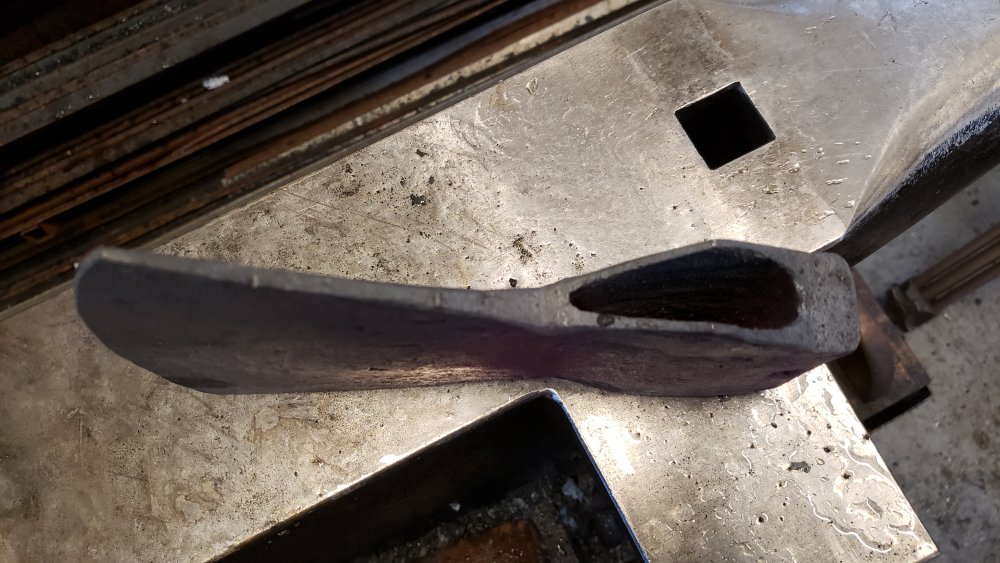
You are a GUI agent. You are given a task and a screenshot of the screen. Output one action in this format:
    pyautogui.click(x=<x>, y=<y>)
    Task: Click on the table
    The image size is (1000, 563).
    Given the screenshot: What is the action you would take?
    pyautogui.click(x=958, y=471), pyautogui.click(x=541, y=535)